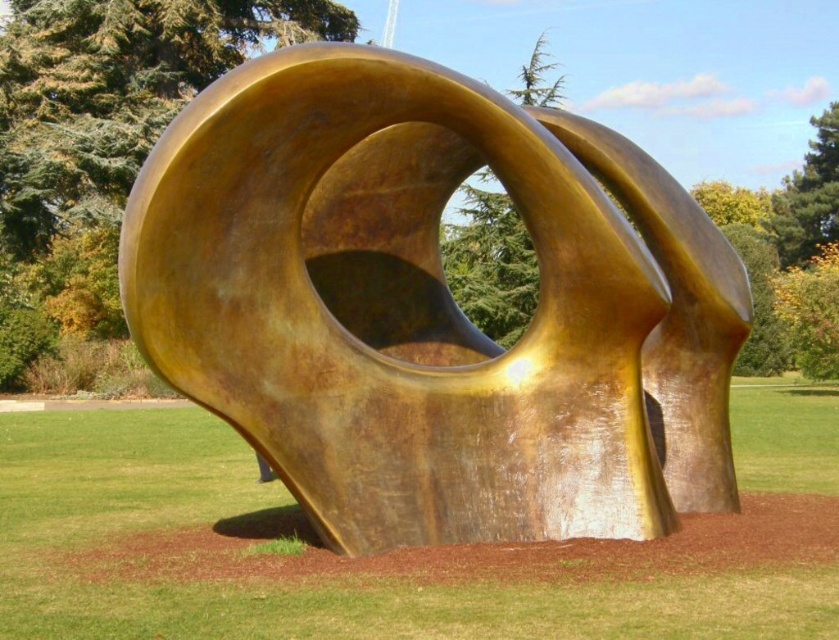
Question: In this image, where is gold polished sculpture at center located relative to green grass at center?

Choices:
 (A) below
 (B) above

Answer: (B)

Question: From the image, what is the correct spatial relationship of gold polished sculpture at center in relation to green grass at center?

Choices:
 (A) above
 (B) below

Answer: (A)

Question: Among these objects, which one is nearest to the camera?

Choices:
 (A) gold polished sculpture at center
 (B) green grass at center

Answer: (B)

Question: Observing the image, what is the correct spatial positioning of gold polished sculpture at center in reference to green grass at center?

Choices:
 (A) below
 (B) above

Answer: (B)

Question: Which point is farther from the camera taking this photo?

Choices:
 (A) (397, 449)
 (B) (108, 632)

Answer: (A)